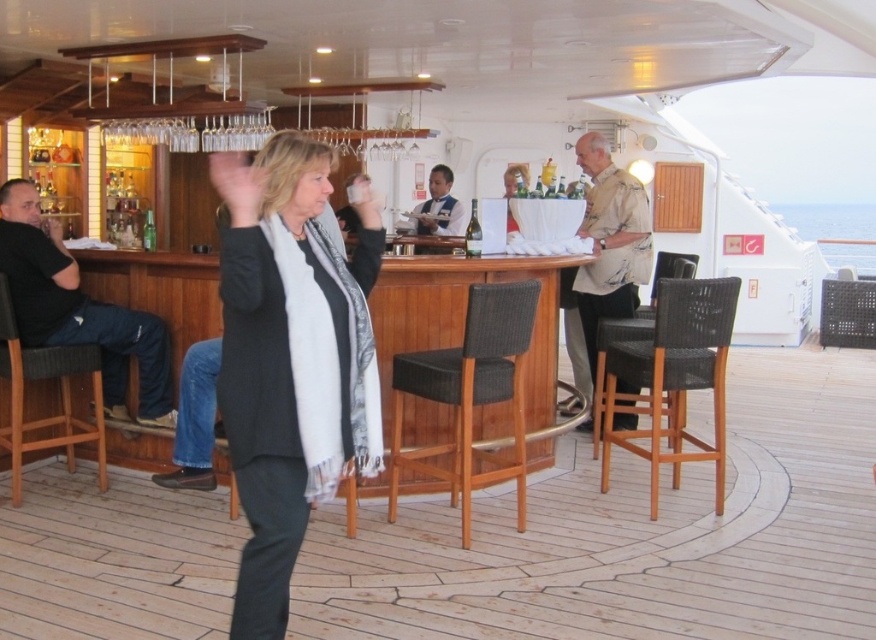
Question: Is black cotton shirt at left thinner than woven wood bar stool at center?

Choices:
 (A) no
 (B) yes

Answer: (A)

Question: Does woven wood bar stool at center appear over dark blue uniform at center?

Choices:
 (A) yes
 (B) no

Answer: (B)

Question: Which of the following is the closest to the observer?

Choices:
 (A) (694, 532)
 (B) (92, 314)

Answer: (A)

Question: Among these objects, which one is nearest to the camera?

Choices:
 (A) woven wood bar stool at center
 (B) wooden deck at center
 (C) dark blue uniform at center
 (D) green glass bottle at center

Answer: (B)

Question: Which is farther from the black woolen sweater at center?

Choices:
 (A) black cotton shirt at left
 (B) wooden deck at center
 (C) beige textured shirt at center

Answer: (C)

Question: Does black cotton shirt at left appear over green glass bottle at center?

Choices:
 (A) no
 (B) yes

Answer: (A)